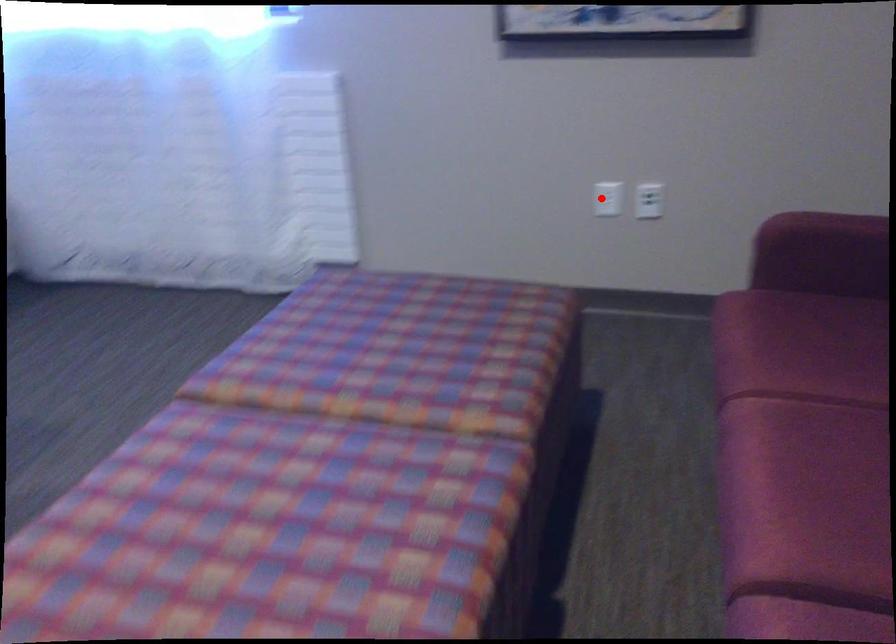
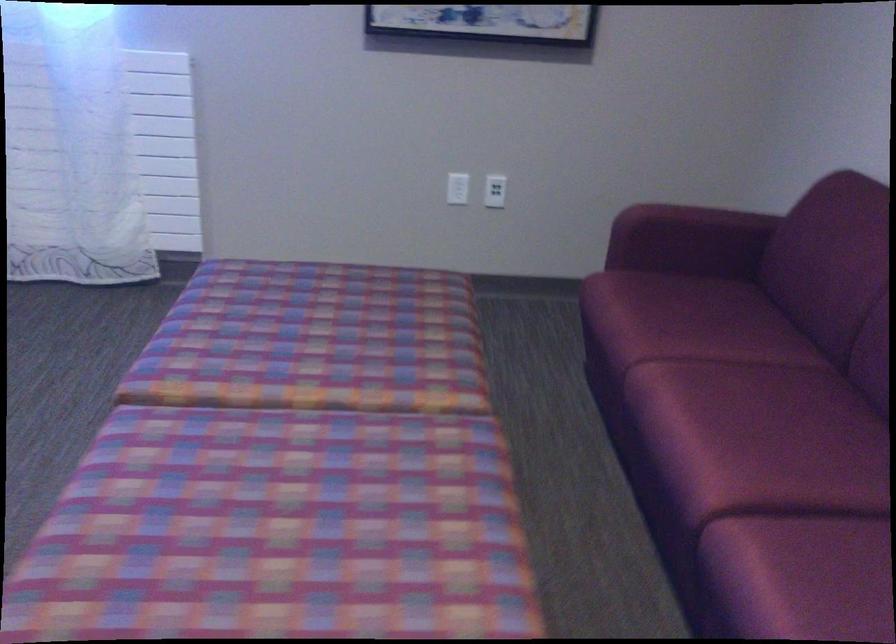
The point at the highlighted location is marked in the first image. Where is the corresponding point in the second image?

(458, 187)